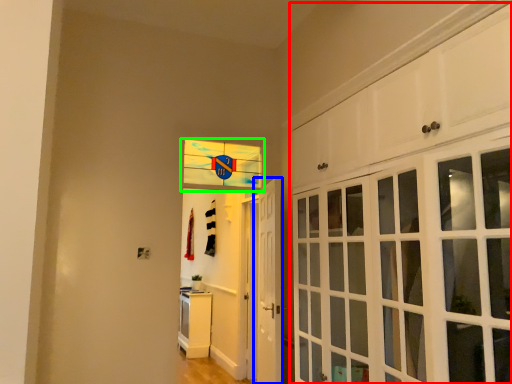
Question: Considering the real-world distances, which object is farthest from cabinetry (highlighted by a red box)? door (highlighted by a blue box) or window (highlighted by a green box)?

Choices:
 (A) door
 (B) window

Answer: (B)